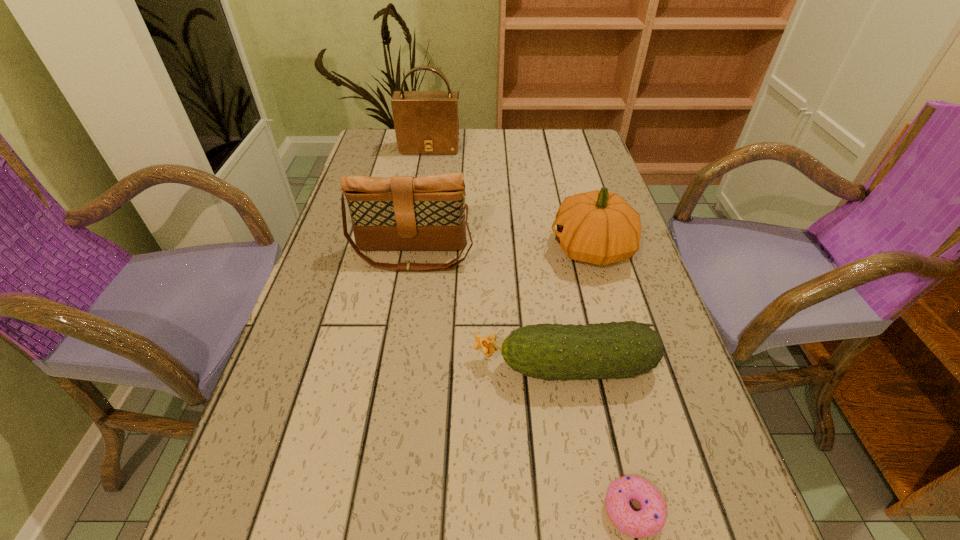
In the image, there is a desktop. Where is `free space at the right edge`? free space at the right edge is located at coordinates (597, 290).

Where is `free spot between the cucumber and the gourd`? free spot between the cucumber and the gourd is located at coordinates (578, 307).

The width and height of the screenshot is (960, 540). Find the location of `vacant space in between the nearer shoulder bag and the cucumber`. vacant space in between the nearer shoulder bag and the cucumber is located at coordinates (489, 310).

Where is `vacant point located between the gourd and the fourth tallest object`? The image size is (960, 540). vacant point located between the gourd and the fourth tallest object is located at coordinates (578, 307).

Where is `vacant area that lies between the shorter shoulder bag and the gourd`? The image size is (960, 540). vacant area that lies between the shorter shoulder bag and the gourd is located at coordinates (502, 252).

The image size is (960, 540). What are the coordinates of `object that ranks as the third closest to the nearer shoulder bag` in the screenshot? It's located at (426, 122).

Select which object appears as the closest to the second nearest object. Please provide its 2D coordinates. Your answer should be formatted as a tuple, i.e. [(x, y)], where the tuple contains the x and y coordinates of a point satisfying the conditions above.

[(651, 518)]

You are a GUI agent. You are given a task and a screenshot of the screen. Output one action in this format:
    pyautogui.click(x=<x>, y=<y>)
    Task: Click on the blank space that satisfies the following two spatial constraints: 1. on the side of the third tallest object with the carved face; 2. on the front-facing side of the nearer shoulder bag
    This screenshot has height=540, width=960.
    Given the screenshot: What is the action you would take?
    pyautogui.click(x=594, y=255)

Image resolution: width=960 pixels, height=540 pixels. In order to click on free space that satisfies the following two spatial constraints: 1. on the side of the third tallest object with the carved face; 2. on the front-facing side of the shorter shoulder bag in this screenshot , I will do `click(594, 255)`.